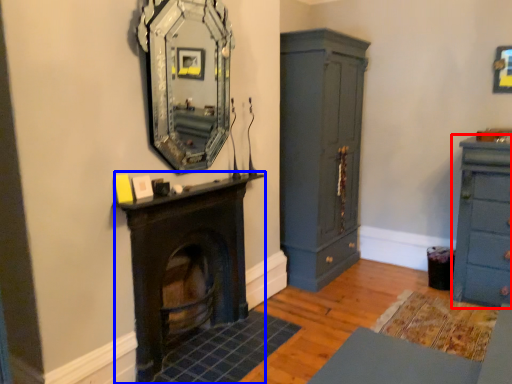
Question: Which point is further to the camera, chest of drawers (highlighted by a red box) or fireplace (highlighted by a blue box)?

Choices:
 (A) chest of drawers
 (B) fireplace

Answer: (A)